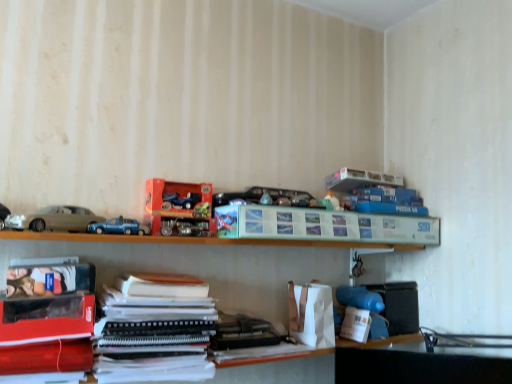
Question: Can you confirm if matte paper paperback book at center, positioned as the 1th paperback book in right-to-left order, is smaller than black matte notebook at center, placed as the first book when sorted from back to front?

Choices:
 (A) yes
 (B) no

Answer: (B)

Question: From a real-world perspective, is matte paper paperback book at center, which is the 2th paperback book from left to right, positioned over black matte notebook at center, marked as the 2th book in a top-to-bottom arrangement, based on gravity?

Choices:
 (A) no
 (B) yes

Answer: (B)

Question: Is matte paper paperback book at center, which is the 2th paperback book from left to right, touching black matte notebook at center, placed as the first book when sorted from back to front?

Choices:
 (A) yes
 (B) no

Answer: (B)

Question: Is matte paper paperback book at center, acting as the first paperback book starting from the top, closer to camera compared to black matte notebook at center, placed as the first book when sorted from back to front?

Choices:
 (A) no
 (B) yes

Answer: (B)

Question: Can you confirm if matte paper paperback book at center, arranged as the 2th paperback book when viewed from the front, is taller than black matte notebook at center, which ranks as the second book in front-to-back order?

Choices:
 (A) no
 (B) yes

Answer: (A)

Question: Is matte paper paperback book at center, positioned as the 1th paperback book in right-to-left order, bigger than black matte notebook at center, placed as the first book when sorted from back to front?

Choices:
 (A) yes
 (B) no

Answer: (A)

Question: From the image's perspective, is matte beige car at left, the 1th car in the right-to-left sequence, on top of matte plastic toy at upper right, marked as the third toy in a right-to-left arrangement?

Choices:
 (A) yes
 (B) no

Answer: (B)

Question: Would you consider matte beige car at left, the 2th car from the left, to be distant from matte plastic toy at upper right, arranged as the 3th toy when viewed from the left?

Choices:
 (A) no
 (B) yes

Answer: (A)

Question: Does matte beige car at left, the 1th car in the right-to-left sequence, turn towards matte plastic toy at upper right, marked as the third toy in a right-to-left arrangement?

Choices:
 (A) yes
 (B) no

Answer: (B)

Question: Does matte beige car at left, the 2th car from the left, come behind matte plastic toy at upper right, the third toy when ordered from top to bottom?

Choices:
 (A) no
 (B) yes

Answer: (A)

Question: Is matte beige car at left, the 2th car from the left, oriented away from matte plastic toy at upper right, marked as the third toy in a right-to-left arrangement?

Choices:
 (A) no
 (B) yes

Answer: (A)

Question: Does matte beige car at left, the 1th car in the right-to-left sequence, have a larger size compared to matte plastic toy at upper right, arranged as the 3th toy when viewed from the left?

Choices:
 (A) no
 (B) yes

Answer: (B)

Question: Can you confirm if white matte toy at lower right, placed as the second toy when sorted from right to left, is thinner than matte paper paperback book at center, the 1th paperback book from the back?

Choices:
 (A) yes
 (B) no

Answer: (B)